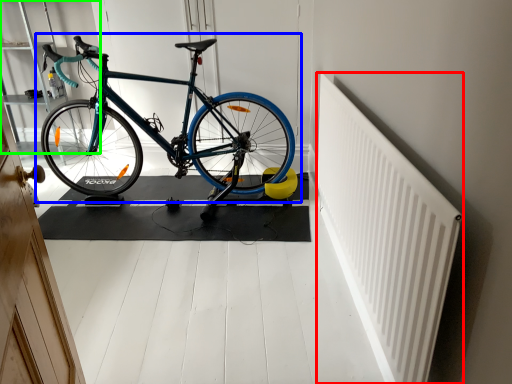
Question: Considering the real-world distances, which object is farthest from radiator (highlighted by a red box)? bicycle (highlighted by a blue box) or shelf (highlighted by a green box)?

Choices:
 (A) bicycle
 (B) shelf

Answer: (B)